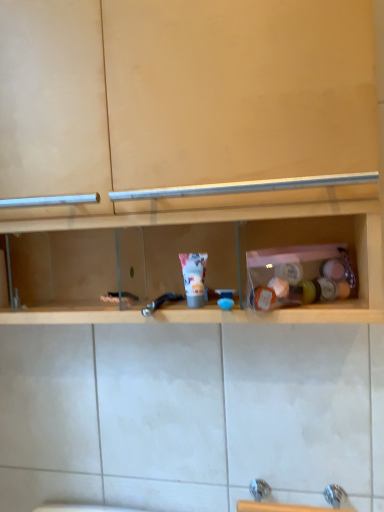
At what (x,y) coordinates should I click in order to perform the action: click on metallic blue faucet at center. Please return your answer as a coordinate pair (x, y). Image resolution: width=384 pixels, height=512 pixels. Looking at the image, I should click on (161, 302).

Is white matte tube at center at the back of metallic blue faucet at center?

No, metallic blue faucet at center's orientation is not away from white matte tube at center.

Considering the sizes of objects metallic blue faucet at center and white matte tube at center in the image provided, who is shorter, metallic blue faucet at center or white matte tube at center?

With less height is metallic blue faucet at center.

Between point (151, 302) and point (193, 262), which one is positioned in front?

The point (193, 262) is in front.

Based on the photo, which is more to the right, metallic blue faucet at center or white matte tube at center?

From the viewer's perspective, white matte tube at center appears more on the right side.

Which of these two, wooden shelf at center or metallic blue faucet at center, is bigger?

With larger size is wooden shelf at center.

From a real-world perspective, is wooden shelf at center physically located above or below metallic blue faucet at center?

In terms of real-world spatial position, wooden shelf at center is above metallic blue faucet at center.

In terms of width, does wooden shelf at center look wider or thinner when compared to metallic blue faucet at center?

Considering their sizes, wooden shelf at center looks broader than metallic blue faucet at center.

Is the surface of wooden shelf at center in direct contact with metallic blue faucet at center?

No, wooden shelf at center is not in contact with metallic blue faucet at center.

Can you confirm if white matte tube at center is taller than metallic blue faucet at center?

Yes, white matte tube at center is taller than metallic blue faucet at center.

Considering the sizes of objects white matte tube at center and metallic blue faucet at center in the image provided, who is smaller, white matte tube at center or metallic blue faucet at center?

With smaller size is metallic blue faucet at center.

Are white matte tube at center and metallic blue faucet at center far apart?

Actually, white matte tube at center and metallic blue faucet at center are a little close together.

This screenshot has height=512, width=384. Find the location of `toiletry that is above the metallic blue faucet at center (from a real-world perspective)`. toiletry that is above the metallic blue faucet at center (from a real-world perspective) is located at coordinates [x=194, y=277].

In the scene shown: Is there a large distance between metallic blue faucet at center and wooden shelf at center?

No, metallic blue faucet at center is not far from wooden shelf at center.

Considering the sizes of objects metallic blue faucet at center and wooden shelf at center in the image provided, who is thinner, metallic blue faucet at center or wooden shelf at center?

With smaller width is metallic blue faucet at center.

How far apart are metallic blue faucet at center and wooden shelf at center?

metallic blue faucet at center and wooden shelf at center are 13.54 inches apart.

In terms of size, does metallic blue faucet at center appear bigger or smaller than wooden shelf at center?

In the image, metallic blue faucet at center appears to be smaller than wooden shelf at center.

From a real-world perspective, does white matte tube at center stand above wooden shelf at center?

No, from a real-world perspective, white matte tube at center is not over wooden shelf at center

Which point is more forward, (190, 272) or (61, 167)?

The point (190, 272) is closer to the camera.

Is white matte tube at center to the left or to the right of wooden shelf at center in the image?

From the image, it's evident that white matte tube at center is to the right of wooden shelf at center.

Based on the photo, would you say white matte tube at center is outside wooden shelf at center?

Actually, white matte tube at center is within wooden shelf at center.

Considering the sizes of wooden shelf at center and white matte tube at center in the image, is wooden shelf at center wider or thinner than white matte tube at center?

Considering their sizes, wooden shelf at center looks broader than white matte tube at center.

The image size is (384, 512). In order to click on toiletry that is below the wooden shelf at center (from the image's perspective) in this screenshot , I will do `click(194, 277)`.

Looking at this image, is wooden shelf at center completely or partially outside of white matte tube at center?

wooden shelf at center is positioned outside white matte tube at center.

Which object is positioned more to the right, wooden shelf at center or white matte tube at center?

white matte tube at center.

In order to click on faucet below the white matte tube at center (from a real-world perspective) in this screenshot , I will do click(161, 302).

Image resolution: width=384 pixels, height=512 pixels. Identify the location of faucet on the right of wooden shelf at center. 161,302.

From the image, which object appears to be farther from metallic blue faucet at center, white matte tube at center or wooden shelf at center?

The object further to metallic blue faucet at center is wooden shelf at center.

When comparing their distances from wooden shelf at center, does metallic blue faucet at center or white matte tube at center seem closer?

white matte tube at center is closer to wooden shelf at center.

Consider the image. Considering their positions, is white matte tube at center positioned closer to wooden shelf at center than metallic blue faucet at center?

The object closer to wooden shelf at center is white matte tube at center.

When comparing their distances from white matte tube at center, does wooden shelf at center or metallic blue faucet at center seem further?

wooden shelf at center.

Which object lies nearer to the anchor point metallic blue faucet at center, wooden shelf at center or white matte tube at center?

The object closer to metallic blue faucet at center is white matte tube at center.

Which object lies nearer to the anchor point white matte tube at center, metallic blue faucet at center or wooden shelf at center?

Based on the image, metallic blue faucet at center appears to be nearer to white matte tube at center.

Where is `toiletry between wooden shelf at center and metallic blue faucet at center vertically`? This screenshot has width=384, height=512. toiletry between wooden shelf at center and metallic blue faucet at center vertically is located at coordinates (x=194, y=277).